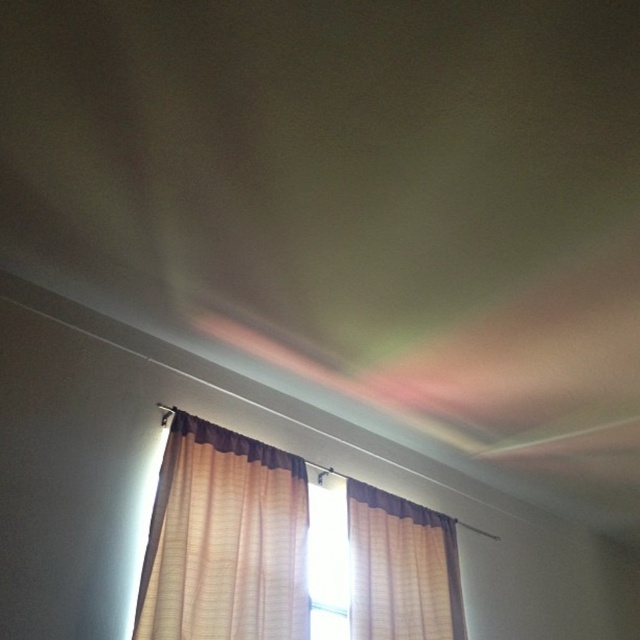
Question: Is beige fabric curtain at lower left closer to the viewer compared to transparent glass window at center?

Choices:
 (A) no
 (B) yes

Answer: (B)

Question: Which point is closer to the camera taking this photo?

Choices:
 (A) (323, 525)
 (B) (394, 528)

Answer: (A)

Question: Which object is positioned farthest from the beige fabric curtain at lower left?

Choices:
 (A) beige textured curtain at upper right
 (B) transparent glass window at center

Answer: (A)

Question: Does beige textured curtain at upper right have a smaller size compared to transparent glass window at center?

Choices:
 (A) no
 (B) yes

Answer: (A)

Question: Among these points, which one is farthest from the camera?

Choices:
 (A) (188, 609)
 (B) (352, 541)
 (C) (340, 540)

Answer: (C)

Question: Can you confirm if beige fabric curtain at lower left is wider than beige textured curtain at upper right?

Choices:
 (A) yes
 (B) no

Answer: (A)